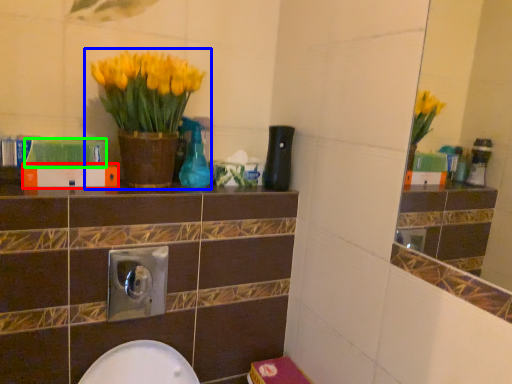
Question: Which object is the closest to the book (highlighted by a red box)? Choose among these: houseplant (highlighted by a blue box) or book (highlighted by a green box).

Choices:
 (A) houseplant
 (B) book

Answer: (B)